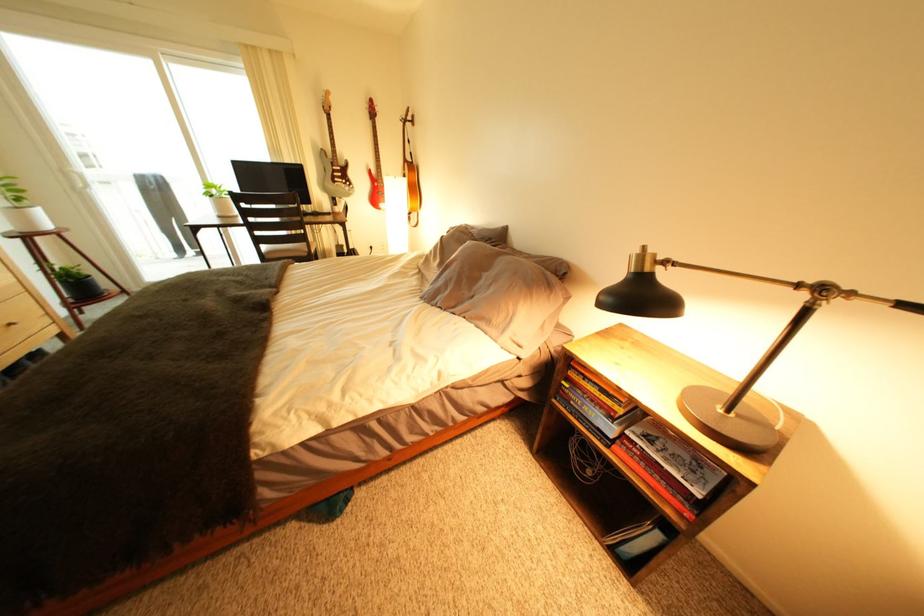
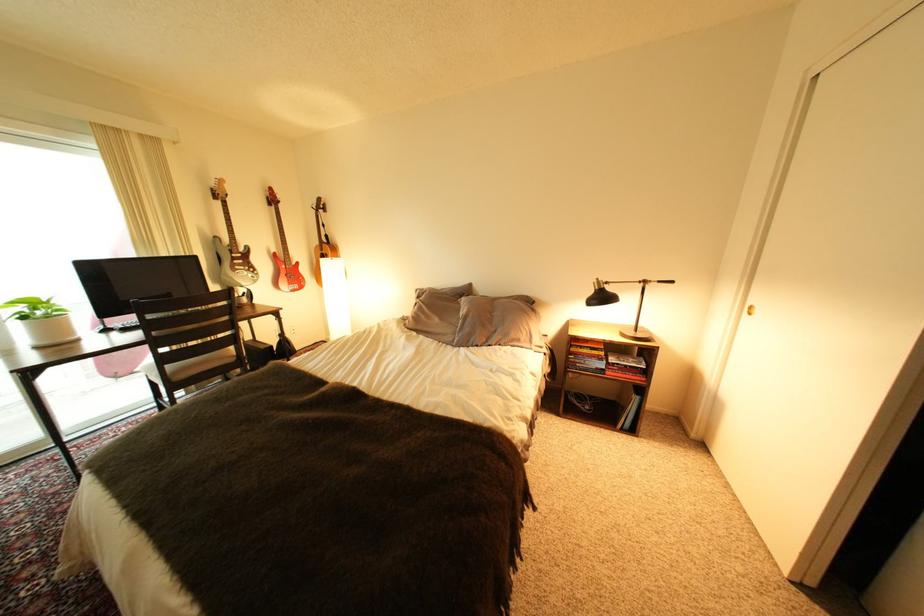
Locate, in the second image, the point that corresponds to point (225, 198) in the first image.

(37, 318)